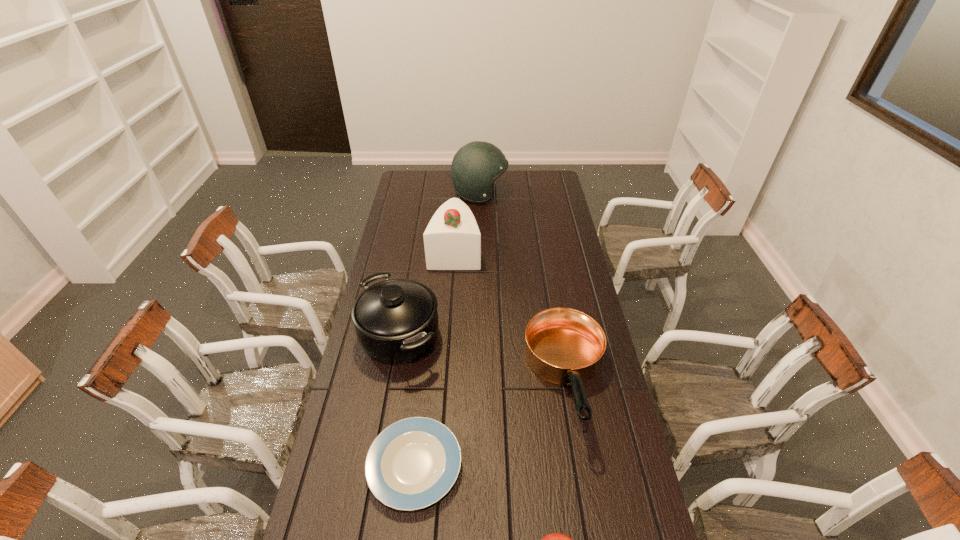
At what (x,y) coordinates should I click in order to perform the action: click on object located in the far edge section of the desktop. Please return your answer as a coordinate pair (x, y). Looking at the image, I should click on pos(475,167).

Where is `saucepan that is at the left edge`? saucepan that is at the left edge is located at coordinates (396, 321).

You are a GUI agent. You are given a task and a screenshot of the screen. Output one action in this format:
    pyautogui.click(x=<x>, y=<y>)
    Task: Click on the plate present at the left edge
    
    Given the screenshot: What is the action you would take?
    pyautogui.click(x=413, y=463)

Where is `object located in the right edge section of the desktop`? This screenshot has width=960, height=540. object located in the right edge section of the desktop is located at coordinates (564, 346).

Locate an element on the screen. vacant space at the far edge is located at coordinates (449, 172).

This screenshot has height=540, width=960. I want to click on vacant space at the left edge of the desktop, so click(x=371, y=370).

Locate an element on the screen. The width and height of the screenshot is (960, 540). free space at the right edge is located at coordinates (557, 266).

Image resolution: width=960 pixels, height=540 pixels. I want to click on vacant space at the far left corner of the desktop, so click(416, 173).

I want to click on free space at the far right corner of the desktop, so click(x=546, y=174).

You are a GUI agent. You are given a task and a screenshot of the screen. Output one action in this format:
    pyautogui.click(x=<x>, y=<y>)
    Task: Click on the free space between the saucepan and the fourth tallest object
    The image size is (960, 540).
    Given the screenshot: What is the action you would take?
    pyautogui.click(x=483, y=358)